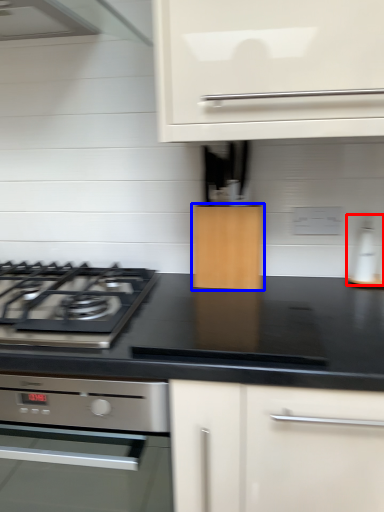
Question: Which object appears farthest to the camera in this image, kitchen appliance (highlighted by a red box) or cabinetry (highlighted by a blue box)?

Choices:
 (A) kitchen appliance
 (B) cabinetry

Answer: (A)